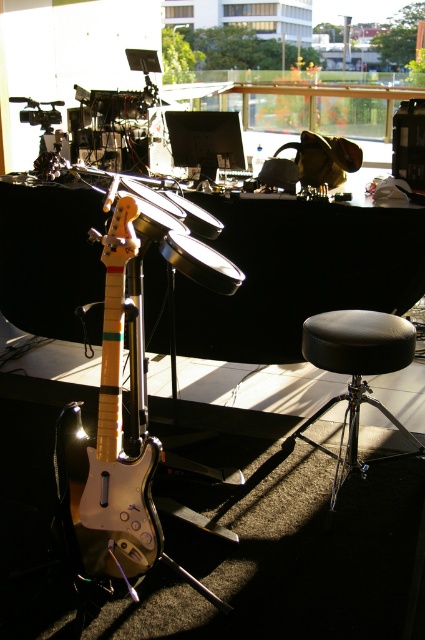
Question: Can you confirm if glossy wood guitar at center is thinner than black leather stool at lower right?

Choices:
 (A) no
 (B) yes

Answer: (B)

Question: Which point is farther from the camera taking this photo?

Choices:
 (A) (125, 545)
 (B) (314, 316)

Answer: (B)

Question: Considering the relative positions of glossy wood guitar at center and black leather stool at lower right in the image provided, where is glossy wood guitar at center located with respect to black leather stool at lower right?

Choices:
 (A) below
 (B) above

Answer: (B)

Question: In this image, where is glossy wood guitar at center located relative to black leather stool at lower right?

Choices:
 (A) below
 (B) above

Answer: (B)